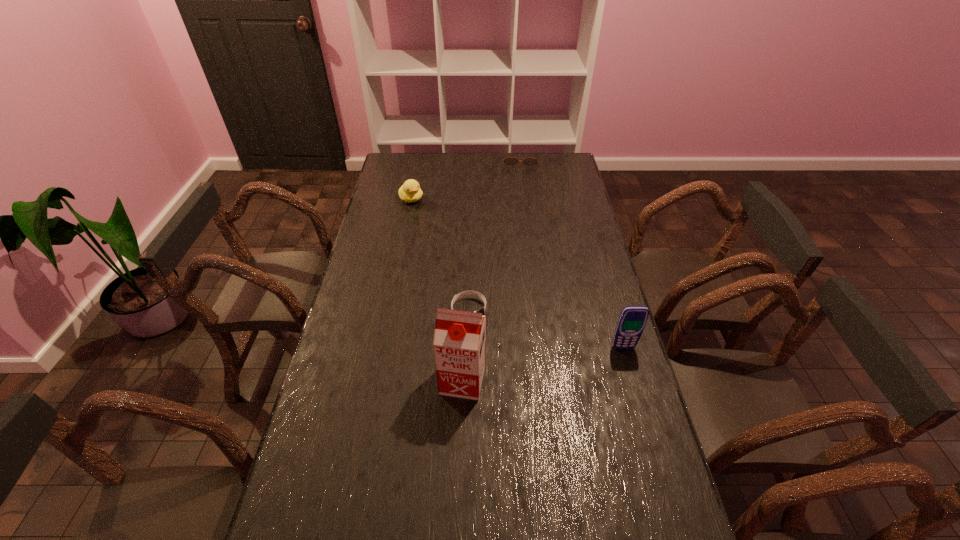
I want to click on blank area located 0.350m on the front-facing side of the fourth shortest object, so click(656, 461).

You are a GUI agent. You are given a task and a screenshot of the screen. Output one action in this format:
    pyautogui.click(x=<x>, y=<y>)
    Task: Click on the vacant space located 0.150m at the beak of the leftmost object
    This screenshot has height=540, width=960.
    Given the screenshot: What is the action you would take?
    pyautogui.click(x=432, y=223)

Identify the location of blank area located at the beak of the leftmost object. pyautogui.click(x=453, y=247).

The height and width of the screenshot is (540, 960). In order to click on vacant region located 0.340m at the beak of the leftmost object in this screenshot , I will do `click(454, 248)`.

Identify the location of vacant space located 0.230m on the outer surface of the third farthest object. (527, 366).

Find the location of a particular element. This screenshot has height=540, width=960. vacant space located on the outer surface of the third farthest object is located at coordinates (551, 388).

This screenshot has width=960, height=540. In order to click on blank space located 0.400m on the outer surface of the third farthest object in this screenshot , I will do `click(569, 405)`.

Locate an element on the screen. The height and width of the screenshot is (540, 960). free spot located 0.200m on the face of the farthest object is located at coordinates (521, 189).

The height and width of the screenshot is (540, 960). I want to click on free region located 0.340m on the face of the farthest object, so click(x=522, y=207).

The width and height of the screenshot is (960, 540). Find the location of `vacant space located 0.310m on the face of the farthest object`. vacant space located 0.310m on the face of the farthest object is located at coordinates (522, 203).